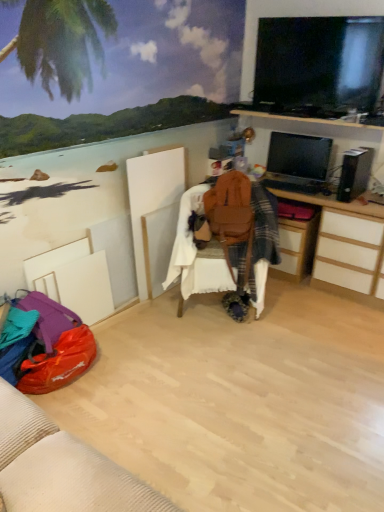
You are a GUI agent. You are given a task and a screenshot of the screen. Output one action in this format:
    pyautogui.click(x=<x>, y=<y>)
    Task: Click on the wooden drawer at center-right
    The width and height of the screenshot is (384, 512).
    Given the screenshot: What is the action you would take?
    pyautogui.click(x=296, y=248)

Where is `brown leather bean bag chair at center`? This screenshot has width=384, height=512. brown leather bean bag chair at center is located at coordinates (226, 239).

What is the approximate width of wooden computer desk at center right?

The width of wooden computer desk at center right is 20.24 inches.

Locate an element on the screen. matte black monitor at upper right, the 1th television ordered from the bottom is located at coordinates (299, 156).

Is wooden drawer at center-right at the right side of wooden computer desk at center right?

In fact, wooden drawer at center-right is to the left of wooden computer desk at center right.

Which is behind, point (284, 248) or point (332, 284)?

The point (284, 248) is behind.

This screenshot has width=384, height=512. In order to click on computer desk lying above the wooden drawer at center-right (from the image's perspective) in this screenshot , I will do `click(316, 132)`.

Which of these two, black glossy flat-screen tv at upper right, which appears as the second television when ordered from the bottom, or matte black monitor at upper right, the 1th television ordered from the bottom, is wider?

black glossy flat-screen tv at upper right, which appears as the second television when ordered from the bottom, is wider.

Considering the relative sizes of black glossy flat-screen tv at upper right, which appears as the second television when ordered from the bottom, and matte black monitor at upper right, the 1th television ordered from the bottom, in the image provided, is black glossy flat-screen tv at upper right, which appears as the second television when ordered from the bottom, taller than matte black monitor at upper right, the 1th television ordered from the bottom,?

Yes.

In the scene shown: Who is more distant, black glossy flat-screen tv at upper right, which appears as the first television when viewed from the top, or matte black monitor at upper right, the 1th television ordered from the bottom?

Positioned behind is matte black monitor at upper right, the 1th television ordered from the bottom.

In terms of width, does wooden computer desk at center right look wider or thinner when compared to brown leather bean bag chair at center?

In the image, wooden computer desk at center right appears to be more narrow than brown leather bean bag chair at center.

Considering the sizes of objects wooden computer desk at center right and brown leather bean bag chair at center in the image provided, who is shorter, wooden computer desk at center right or brown leather bean bag chair at center?

With less height is wooden computer desk at center right.

Is wooden computer desk at center right situated inside brown leather bean bag chair at center or outside?

The correct answer is: outside.

From a real-world perspective, which is physically below, wooden computer desk at center right or brown leather bean bag chair at center?

In real-world perspective, wooden computer desk at center right is lower.

Consider the image. Looking at their sizes, would you say matte black monitor at upper right, the 1th television ordered from the bottom, is wider or thinner than brown leather bean bag chair at center?

In the image, matte black monitor at upper right, the 1th television ordered from the bottom, appears to be more narrow than brown leather bean bag chair at center.

From the image's perspective, relative to brown leather bean bag chair at center, is matte black monitor at upper right, the 1th television ordered from the bottom, above or below?

matte black monitor at upper right, the 1th television ordered from the bottom, is situated higher than brown leather bean bag chair at center in the image.

Considering the points (307, 170) and (194, 251), which point is in front, point (307, 170) or point (194, 251)?

Positioned in front is point (194, 251).

How many degrees apart are the facing directions of matte black monitor at upper right, which ranks as the 2th television in top-to-bottom order, and brown leather bean bag chair at center?

There is a 34.6-degree angle between the facing directions of matte black monitor at upper right, which ranks as the 2th television in top-to-bottom order, and brown leather bean bag chair at center.

Which point is more forward, (261,278) or (276,141)?

The point (261,278) is closer to the camera.

From the picture: Considering the positions of objects brown leather bean bag chair at center and matte black monitor at upper right, the 1th television ordered from the bottom, in the image provided, who is more to the right, brown leather bean bag chair at center or matte black monitor at upper right, the 1th television ordered from the bottom,?

matte black monitor at upper right, the 1th television ordered from the bottom.

Is brown leather bean bag chair at center taller than matte black monitor at upper right, the 1th television ordered from the bottom?

Indeed, brown leather bean bag chair at center has a greater height compared to matte black monitor at upper right, the 1th television ordered from the bottom.

Does brown leather bean bag chair at center come in front of matte black monitor at upper right, which ranks as the 2th television in top-to-bottom order?

Yes, brown leather bean bag chair at center is closer to the viewer.

Can you confirm if black glossy flat-screen tv at upper right, which appears as the first television when viewed from the top, is thinner than brown leather bean bag chair at center?

Yes, black glossy flat-screen tv at upper right, which appears as the first television when viewed from the top, is thinner than brown leather bean bag chair at center.

From the image's perspective, is black glossy flat-screen tv at upper right, which appears as the first television when viewed from the top, positioned above or below brown leather bean bag chair at center?

black glossy flat-screen tv at upper right, which appears as the first television when viewed from the top, is above brown leather bean bag chair at center.

Between black glossy flat-screen tv at upper right, which appears as the first television when viewed from the top, and brown leather bean bag chair at center, which one has less height?

Standing shorter between the two is black glossy flat-screen tv at upper right, which appears as the first television when viewed from the top.

Is black glossy flat-screen tv at upper right, which appears as the first television when viewed from the top, spatially inside brown leather bean bag chair at center, or outside of it?

black glossy flat-screen tv at upper right, which appears as the first television when viewed from the top, is outside brown leather bean bag chair at center.

Is matte black monitor at upper right, which ranks as the 2th television in top-to-bottom order, not close to black glossy flat-screen tv at upper right, which appears as the second television when ordered from the bottom?

That's not correct — matte black monitor at upper right, which ranks as the 2th television in top-to-bottom order, is a little close to black glossy flat-screen tv at upper right, which appears as the second television when ordered from the bottom.

From the image's perspective, is matte black monitor at upper right, which ranks as the 2th television in top-to-bottom order, above black glossy flat-screen tv at upper right, which appears as the second television when ordered from the bottom?

No, from the image's perspective, matte black monitor at upper right, which ranks as the 2th television in top-to-bottom order, is not on top of black glossy flat-screen tv at upper right, which appears as the second television when ordered from the bottom.

Which is behind, matte black monitor at upper right, which ranks as the 2th television in top-to-bottom order, or black glossy flat-screen tv at upper right, which appears as the first television when viewed from the top?

matte black monitor at upper right, which ranks as the 2th television in top-to-bottom order, is more distant.

Looking at this image, which of these two, matte black monitor at upper right, the 1th television ordered from the bottom, or black glossy flat-screen tv at upper right, which appears as the first television when viewed from the top, is smaller?

With smaller size is matte black monitor at upper right, the 1th television ordered from the bottom.

Locate an element on the screen. This screenshot has width=384, height=512. computer desk that is in front of the wooden drawer at center-right is located at coordinates (316, 132).

In the image, there is a matte black monitor at upper right, the 1th television ordered from the bottom. Where is `television above it (from the image's perspective)`? This screenshot has width=384, height=512. television above it (from the image's perspective) is located at coordinates (318, 65).

Estimate the real-world distances between objects in this image. Which object is closer to wooden computer desk at center right, matte black monitor at upper right, the 1th television ordered from the bottom, or wooden drawer at center-right?

Based on the image, matte black monitor at upper right, the 1th television ordered from the bottom, appears to be nearer to wooden computer desk at center right.

Looking at the image, which one is located closer to wooden computer desk at center right, brown leather bean bag chair at center or black glossy flat-screen tv at upper right, which appears as the first television when viewed from the top?

Among the two, black glossy flat-screen tv at upper right, which appears as the first television when viewed from the top, is located nearer to wooden computer desk at center right.

Estimate the real-world distances between objects in this image. Which object is closer to matte black monitor at upper right, which ranks as the 2th television in top-to-bottom order, brown leather bean bag chair at center or wooden drawer at center-right?

wooden drawer at center-right lies closer to matte black monitor at upper right, which ranks as the 2th television in top-to-bottom order, than the other object.

Estimate the real-world distances between objects in this image. Which object is further from wooden drawer at center-right, black glossy flat-screen tv at upper right, which appears as the first television when viewed from the top, or wooden computer desk at center right?

Among the two, black glossy flat-screen tv at upper right, which appears as the first television when viewed from the top, is located further to wooden drawer at center-right.

In the scene shown: Looking at the image, which one is located further to brown leather bean bag chair at center, matte black monitor at upper right, which ranks as the 2th television in top-to-bottom order, or black glossy flat-screen tv at upper right, which appears as the first television when viewed from the top?

black glossy flat-screen tv at upper right, which appears as the first television when viewed from the top.

Consider the image. Which object lies nearer to the anchor point wooden computer desk at center right, matte black monitor at upper right, the 1th television ordered from the bottom, or brown leather bean bag chair at center?

Based on the image, matte black monitor at upper right, the 1th television ordered from the bottom, appears to be nearer to wooden computer desk at center right.

From the image, which object appears to be farther from brown leather bean bag chair at center, wooden computer desk at center right or wooden drawer at center-right?

wooden computer desk at center right lies further to brown leather bean bag chair at center than the other object.

Which object lies further to the anchor point wooden drawer at center-right, matte black monitor at upper right, the 1th television ordered from the bottom, or wooden computer desk at center right?

wooden computer desk at center right is further to wooden drawer at center-right.

I want to click on drawer between brown leather bean bag chair at center and wooden computer desk at center right, so click(296, 248).

Image resolution: width=384 pixels, height=512 pixels. In order to click on computer desk that lies between black glossy flat-screen tv at upper right, which appears as the second television when ordered from the bottom, and brown leather bean bag chair at center from top to bottom in this screenshot , I will do `click(316, 132)`.

Image resolution: width=384 pixels, height=512 pixels. In order to click on drawer between black glossy flat-screen tv at upper right, which appears as the second television when ordered from the bottom, and brown leather bean bag chair at center from top to bottom in this screenshot , I will do `click(296, 248)`.

The width and height of the screenshot is (384, 512). What are the coordinates of `drawer between matte black monitor at upper right, the 1th television ordered from the bottom, and brown leather bean bag chair at center, in the vertical direction` in the screenshot? It's located at (296, 248).